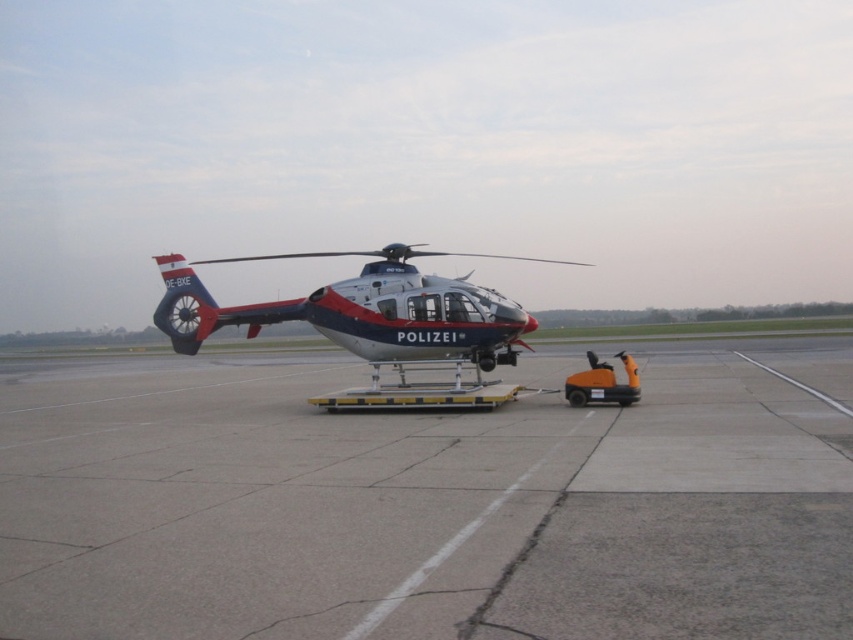
You are standing at the point marked by coordinates point (425, 506) in the image. What type of surface are you standing on?

The point (425, 506) marks gray concrete tarmac at center, so you are standing on gray concrete tarmac.

You are a drone operator trying to land a drone on the gray concrete tarmac at center. What coordinates should you aim for?

The gray concrete tarmac at center is located at coordinates point [425,506], so you should aim for those coordinates to land the drone there.

You are standing in front of the police helicopter at the airport. There are two points marked on the helicopter. One is at coordinate point (x=347, y=568) and the other at point (x=178, y=260). Which point is closer to you?

Point (x=347, y=568) is closer to the camera than point (x=178, y=260).